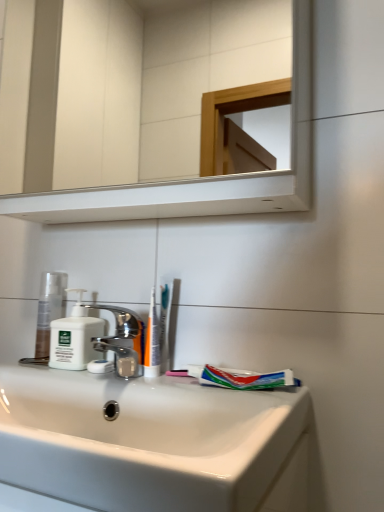
Identify the location of vacant area that lies to the right of polished chrome faucet at center. (193, 389).